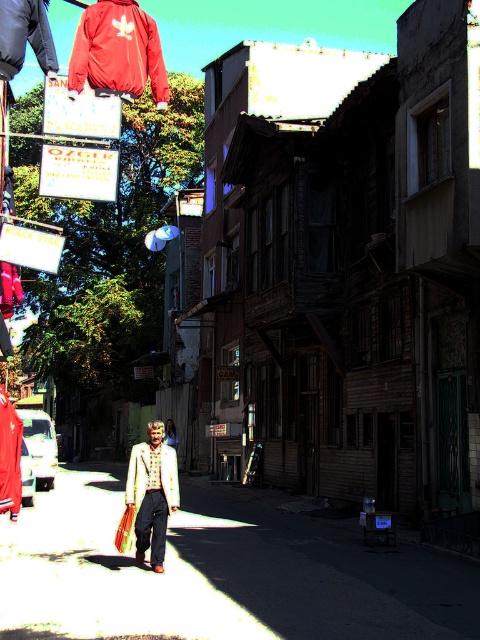
You are a photographer trying to capture both the white textured jacket at center and the matte beige dress at center in a single frame. Given their sizes, which one should you focus on to ensure both fit in the photo without cropping?

Since the white textured jacket at center is smaller than the matte beige dress at center, you should focus on the matte beige dress at center to ensure both fit in the photo without cropping.

You are standing at the point with coordinates point (x=130, y=490) and want to walk to the point with coordinates point (x=67, y=522). Which direction should you face to walk straight towards your destination?

You should face north because point (x=67, y=522) is behind point (x=130, y=490).

You are a delivery person trying to navigate through the street. You see the matte brown wooden alley at center and the matte red jacket at upper left. Which object is bigger in size?

The matte brown wooden alley at center has a larger size compared to the matte red jacket at upper left, so the matte brown wooden alley at center is bigger.